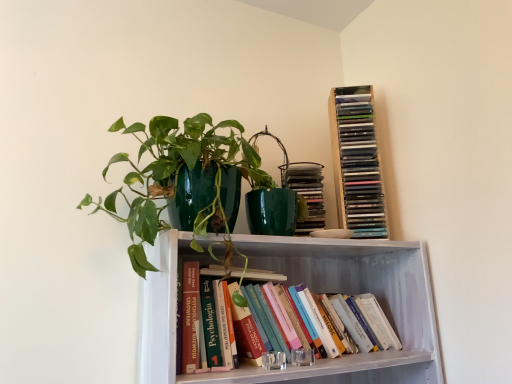
Question: Which direction should I rotate to face hardcover books at center, positioned as the 4th book in top-to-bottom order, — up or down?

Choices:
 (A) up
 (B) down

Answer: (B)

Question: Is green glossy pot at upper center smaller than matte green book at upper right, marked as the third book in a bottom-to-top arrangement?

Choices:
 (A) yes
 (B) no

Answer: (B)

Question: Can you confirm if green glossy pot at upper center is wider than matte green book at upper right, acting as the 2th book starting from the top?

Choices:
 (A) no
 (B) yes

Answer: (B)

Question: Is green glossy pot at upper center to the left of matte green book at upper right, acting as the 2th book starting from the top, from the viewer's perspective?

Choices:
 (A) no
 (B) yes

Answer: (B)

Question: Is green glossy pot at upper center oriented towards matte green book at upper right, marked as the third book in a bottom-to-top arrangement?

Choices:
 (A) no
 (B) yes

Answer: (A)

Question: From the image's perspective, is green glossy pot at upper center beneath matte green book at upper right, marked as the third book in a bottom-to-top arrangement?

Choices:
 (A) yes
 (B) no

Answer: (A)

Question: Is green glossy pot at upper center positioned with its back to matte green book at upper right, acting as the 2th book starting from the top?

Choices:
 (A) no
 (B) yes

Answer: (A)

Question: From a real-world perspective, is hardcover books at center, positioned as the 4th book in top-to-bottom order, over green glossy pot at upper center?

Choices:
 (A) no
 (B) yes

Answer: (A)

Question: Is hardcover books at center, which is the first book in bottom-to-top order, closer to camera compared to green glossy pot at upper center?

Choices:
 (A) yes
 (B) no

Answer: (B)

Question: Considering the relative sizes of hardcover books at center, positioned as the 4th book in top-to-bottom order, and green glossy pot at upper center in the image provided, is hardcover books at center, positioned as the 4th book in top-to-bottom order, smaller than green glossy pot at upper center?

Choices:
 (A) yes
 (B) no

Answer: (A)

Question: From a real-world perspective, is hardcover books at center, which is the first book in bottom-to-top order, physically below green glossy pot at upper center?

Choices:
 (A) yes
 (B) no

Answer: (A)

Question: Is hardcover books at center, positioned as the 4th book in top-to-bottom order, not close to green glossy pot at upper center?

Choices:
 (A) no
 (B) yes

Answer: (A)

Question: Is hardcover books at center, which is the first book in bottom-to-top order, at the left side of green glossy pot at upper center?

Choices:
 (A) yes
 (B) no

Answer: (B)

Question: Considering the relative sizes of hardcover book at center, which is the 2th book in bottom-to-top order, and matte green book at upper right, marked as the third book in a bottom-to-top arrangement, in the image provided, is hardcover book at center, which is the 2th book in bottom-to-top order, shorter than matte green book at upper right, marked as the third book in a bottom-to-top arrangement,?

Choices:
 (A) no
 (B) yes

Answer: (B)